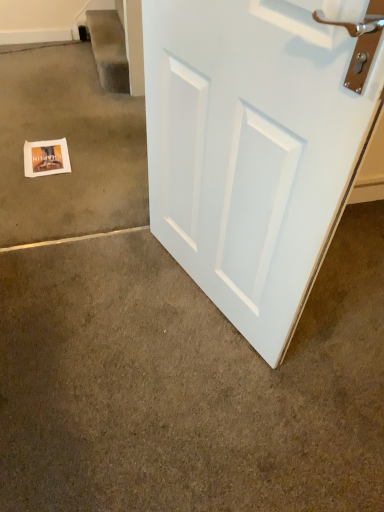
Image resolution: width=384 pixels, height=512 pixels. What are the coordinates of `vacant space to the right of white matte door at right` in the screenshot? It's located at (342, 313).